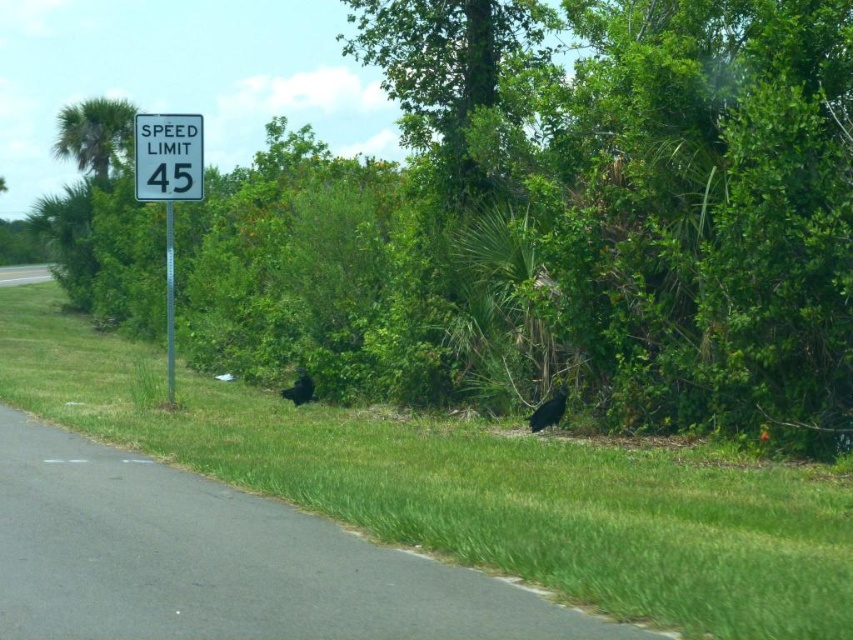
Question: Which object appears farthest from the camera in this image?

Choices:
 (A) white plastic speed limit sign at upper left
 (B) green leafy tree at center
 (C) green leafy tree at upper left
 (D) white plastic speed limit sign at upper center

Answer: (C)

Question: Which object is farther from the camera taking this photo?

Choices:
 (A) white plastic speed limit sign at upper left
 (B) white plastic speed limit sign at upper center
 (C) green leafy tree at center

Answer: (B)

Question: Which point appears farthest from the camera in this image?

Choices:
 (A) (532, 426)
 (B) (672, 336)
 (C) (122, 108)

Answer: (C)

Question: Where is white plastic speed limit sign at upper center located in relation to green leafy tree at upper left in the image?

Choices:
 (A) above
 (B) below

Answer: (B)

Question: Can you confirm if green leafy tree at center is wider than green leafy tree at upper left?

Choices:
 (A) yes
 (B) no

Answer: (A)

Question: From the image, what is the correct spatial relationship of green leafy tree at center in relation to white plastic speed limit sign at upper left?

Choices:
 (A) right
 (B) left

Answer: (A)